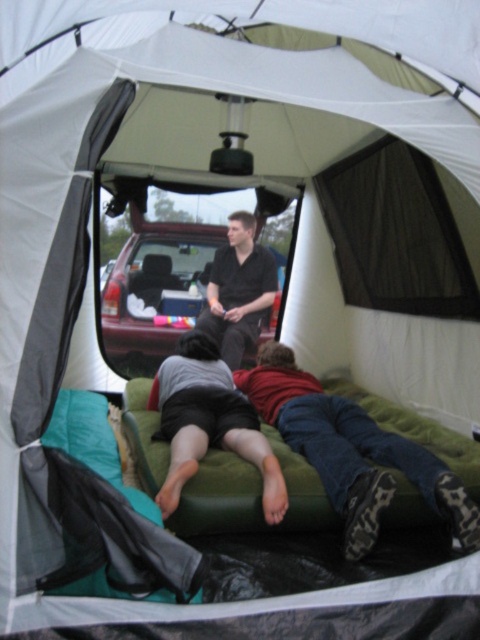
Question: Which of the following is the closest to the observer?

Choices:
 (A) (255, 301)
 (B) (314, 436)
 (C) (190, 244)

Answer: (B)

Question: Can you confirm if denim jeans at lower center is bigger than matte red car at center?

Choices:
 (A) yes
 (B) no

Answer: (A)

Question: Which object is positioned farthest from the matte red car at center?

Choices:
 (A) denim jeans at lower center
 (B) black matte shirt at center

Answer: (A)

Question: Where is denim jeans at lower center located in relation to gray fabric shorts at center in the image?

Choices:
 (A) below
 (B) above

Answer: (B)

Question: Is matte red car at center above gray fabric shorts at center?

Choices:
 (A) yes
 (B) no

Answer: (A)

Question: Which object is positioned closest to the matte red car at center?

Choices:
 (A) black matte shirt at center
 (B) denim jeans at lower center

Answer: (A)